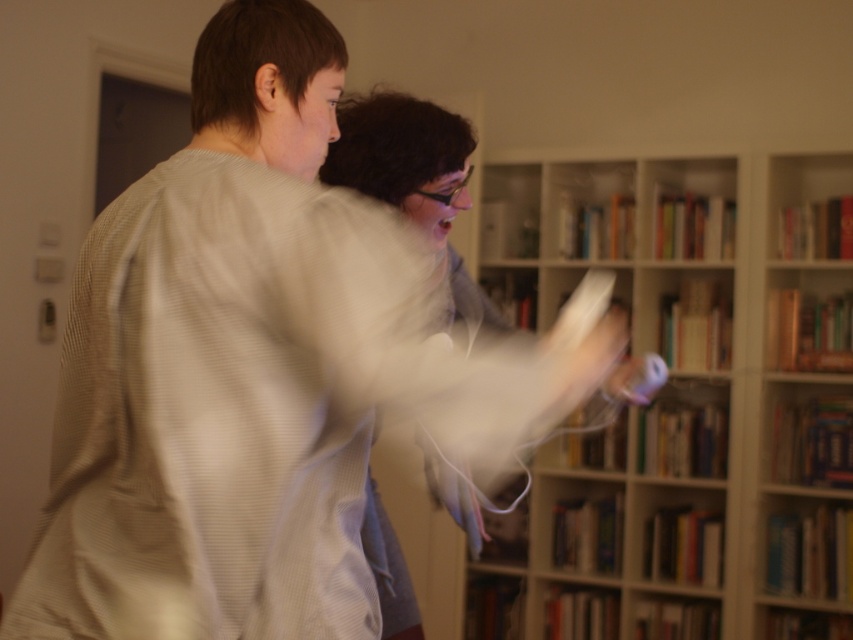
Between wooden bookshelf at center and white matte controller at center, which one is positioned higher?

white matte controller at center is higher up.

Based on the photo, does wooden bookshelf at center have a larger size compared to white matte controller at center?

Yes.

Identify the location of wooden bookshelf at center. This screenshot has height=640, width=853. (693, 400).